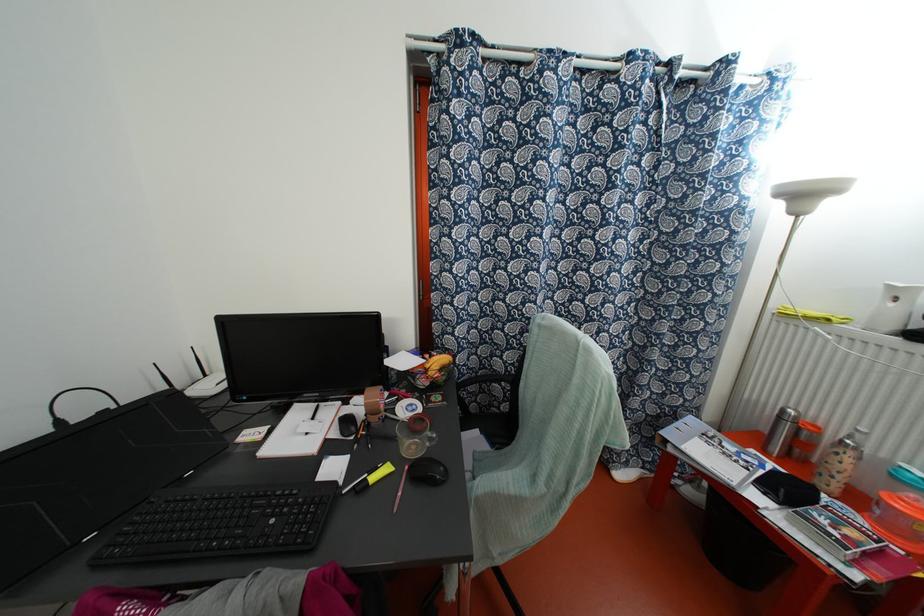
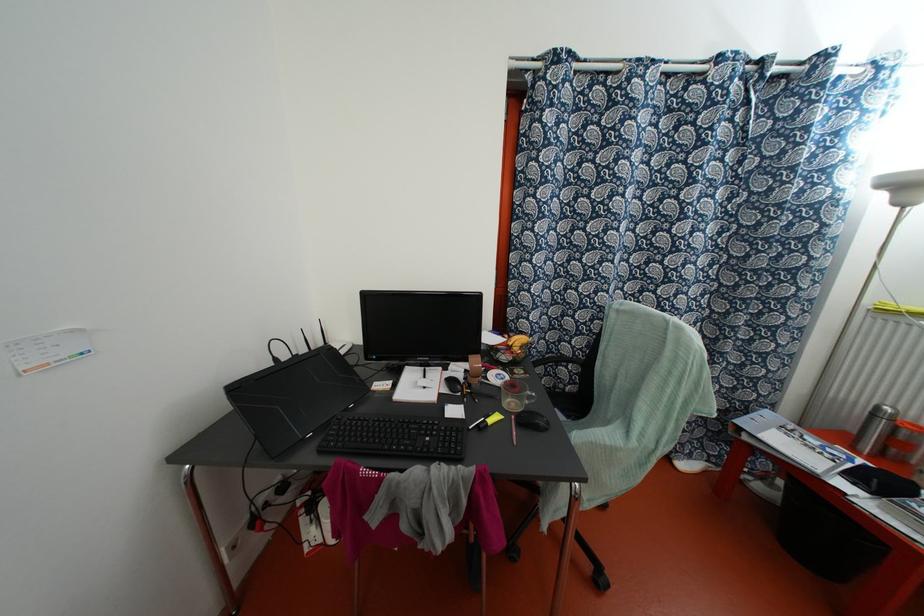
Where in the second image is the point corresponding to (x=371, y=477) from the first image?

(489, 421)